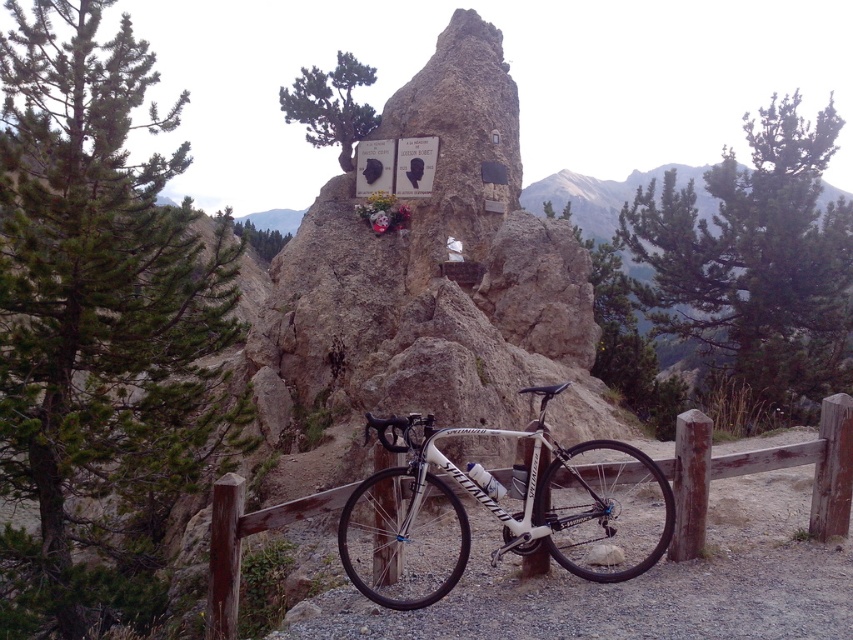
Question: Among these objects, which one is nearest to the camera?

Choices:
 (A) white glossy mountain bike at center
 (B) brown wooden fence at lower center

Answer: (A)

Question: Is green needle-like pine at left bigger than white glossy mountain bike at center?

Choices:
 (A) no
 (B) yes

Answer: (A)

Question: Considering the relative positions of rocky at center and brown wooden fence at lower center in the image provided, where is rocky at center located with respect to brown wooden fence at lower center?

Choices:
 (A) right
 (B) left

Answer: (B)

Question: Which object appears farthest from the camera in this image?

Choices:
 (A) white glossy mountain bike at center
 (B) green textured pine at upper right
 (C) brown wooden fence at lower center

Answer: (B)

Question: Does rocky at center lie behind brown wooden fence at lower center?

Choices:
 (A) yes
 (B) no

Answer: (A)

Question: Which object is the farthest from the brown wooden fence at lower center?

Choices:
 (A) green textured pine at upper right
 (B) white glossy mountain bike at center

Answer: (A)